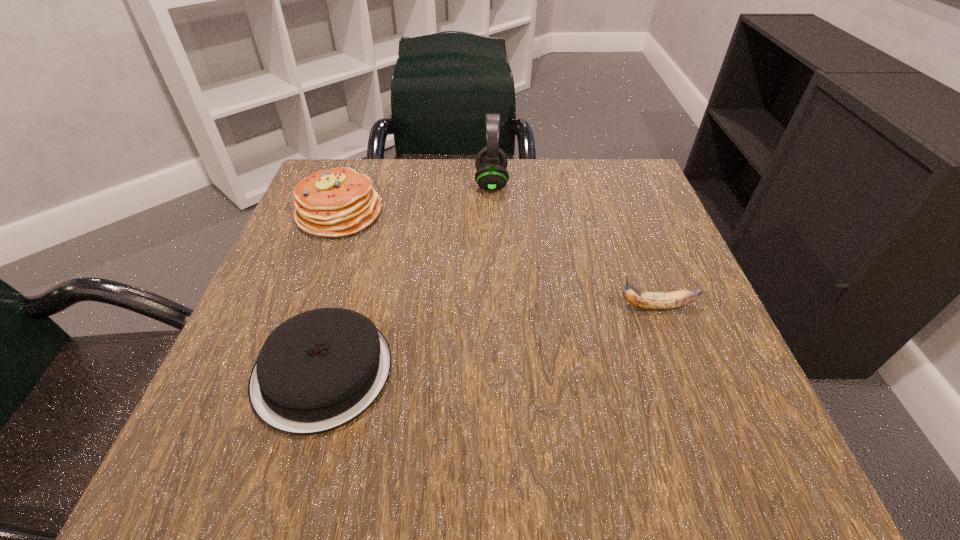
The width and height of the screenshot is (960, 540). In order to click on object that is at the far left corner in this screenshot , I will do `click(338, 202)`.

Where is `object at the near left corner`? Image resolution: width=960 pixels, height=540 pixels. object at the near left corner is located at coordinates (319, 370).

The width and height of the screenshot is (960, 540). In the image, there is a desktop. Find the location of `vacant space at the far edge`. vacant space at the far edge is located at coordinates (555, 203).

In the image, there is a desktop. Where is `free space at the near edge`? The image size is (960, 540). free space at the near edge is located at coordinates (444, 470).

Where is `free space at the left edge`? This screenshot has width=960, height=540. free space at the left edge is located at coordinates (267, 336).

Where is `free location at the right edge`? The image size is (960, 540). free location at the right edge is located at coordinates (648, 328).

In the image, there is a desktop. Where is `free space at the far left corner`? free space at the far left corner is located at coordinates (348, 167).

Locate an element on the screen. Image resolution: width=960 pixels, height=540 pixels. free space at the far right corner of the desktop is located at coordinates (643, 219).

You are a GUI agent. You are given a task and a screenshot of the screen. Output one action in this format:
    pyautogui.click(x=<x>, y=<y>)
    Task: Click on the vacant area between the nearer pancake and the farther pancake
    Image resolution: width=960 pixels, height=540 pixels.
    Given the screenshot: What is the action you would take?
    pyautogui.click(x=331, y=292)

Identify the location of vacant area between the banana and the farther pancake. This screenshot has height=540, width=960. (497, 260).